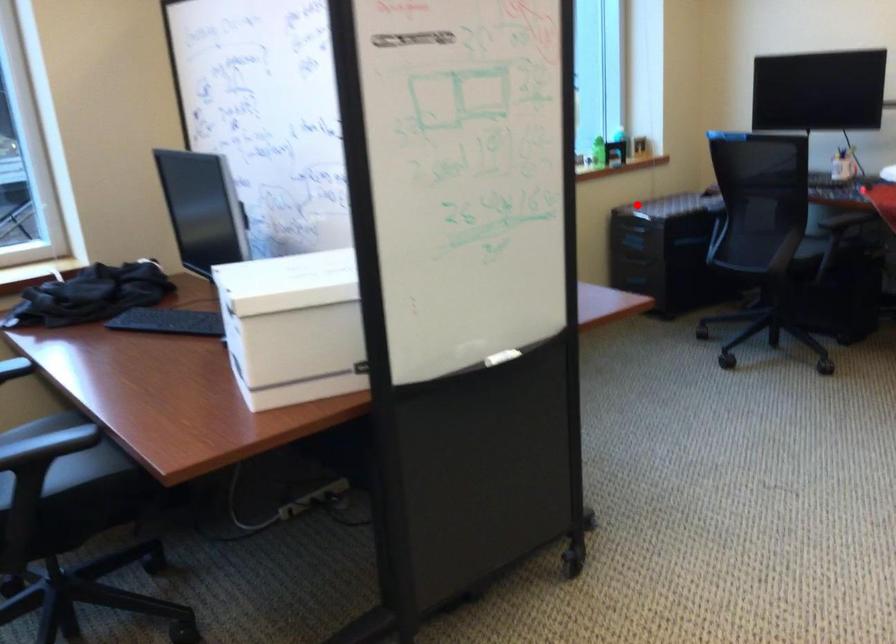
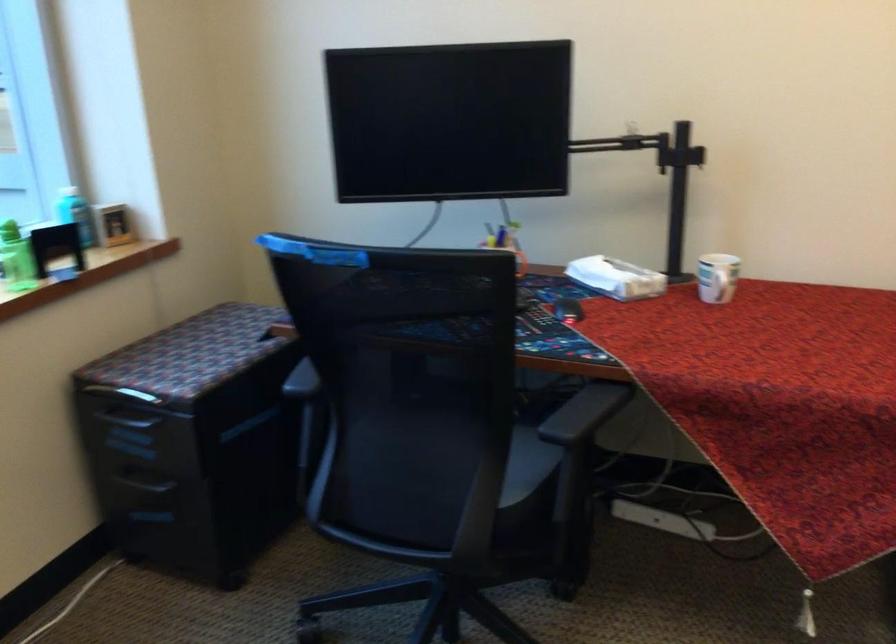
Locate, in the second image, the point that corresponds to the highlighted location in the first image.

(125, 393)